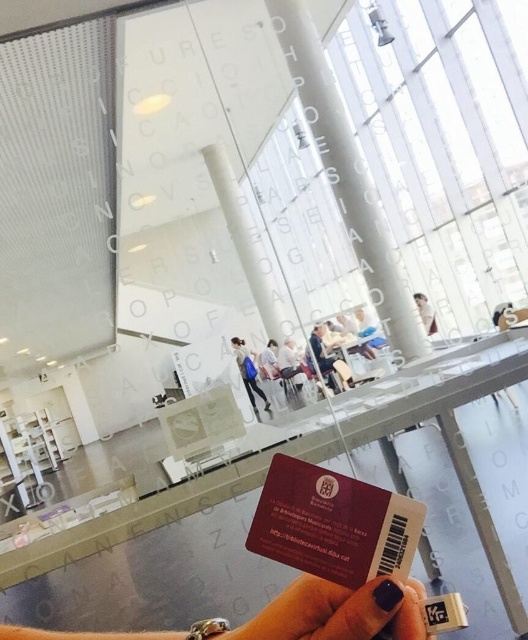
Is nail polish at center shorter than white fabric dress at center?

Indeed, nail polish at center has a lesser height compared to white fabric dress at center.

Can you confirm if nail polish at center is positioned to the left of white fabric dress at center?

No, nail polish at center is not to the left of white fabric dress at center.

At what (x,y) coordinates should I click in order to perform the action: click on nail polish at center. Please return your answer as a coordinate pair (x, y). This screenshot has height=640, width=528. Looking at the image, I should click on (338, 611).

Locate an element on the screen. The width and height of the screenshot is (528, 640). nail polish at center is located at coordinates (338, 611).

Can you confirm if maroon plastic card at center is positioned to the left of nail polish at center?

No, maroon plastic card at center is not to the left of nail polish at center.

Is point (402, 508) farther from camera compared to point (345, 612)?

That is True.

This screenshot has width=528, height=640. I want to click on maroon plastic card at center, so click(334, 524).

Between point (393, 614) and point (310, 358), which one is positioned in front?

Point (393, 614) is more forward.

Is nail polish at center positioned before light blue fabric chair at center?

Yes, nail polish at center is in front of light blue fabric chair at center.

Does point (398, 593) come behind point (308, 356)?

No, it is not.

Identify the location of nail polish at center. This screenshot has width=528, height=640. (338, 611).